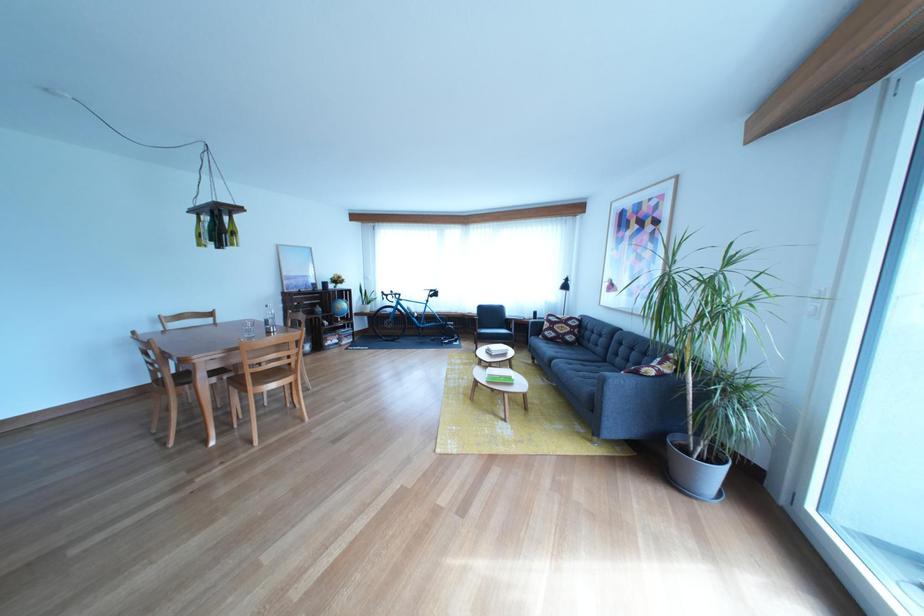
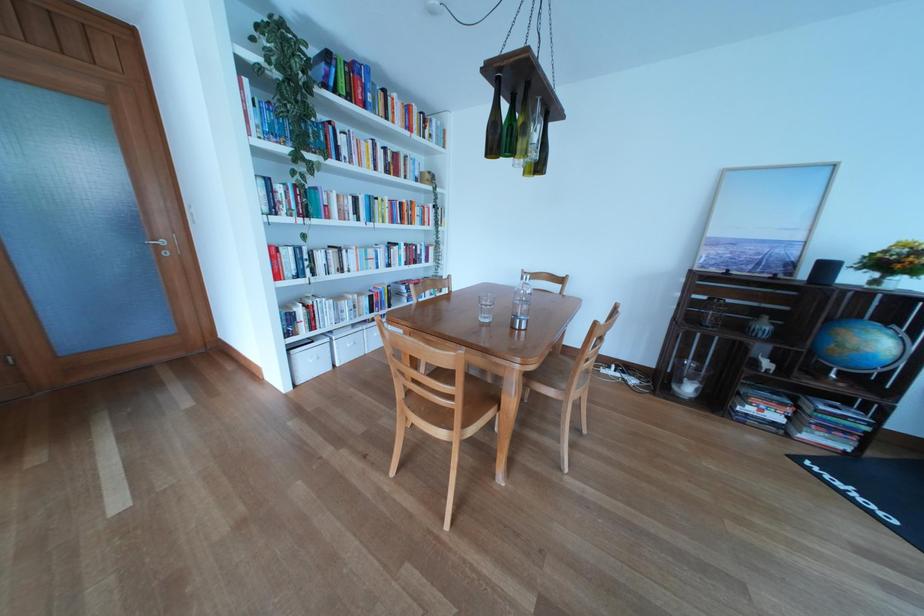
The point at (342, 349) is marked in the first image. Where is the corresponding point in the second image?

(762, 416)